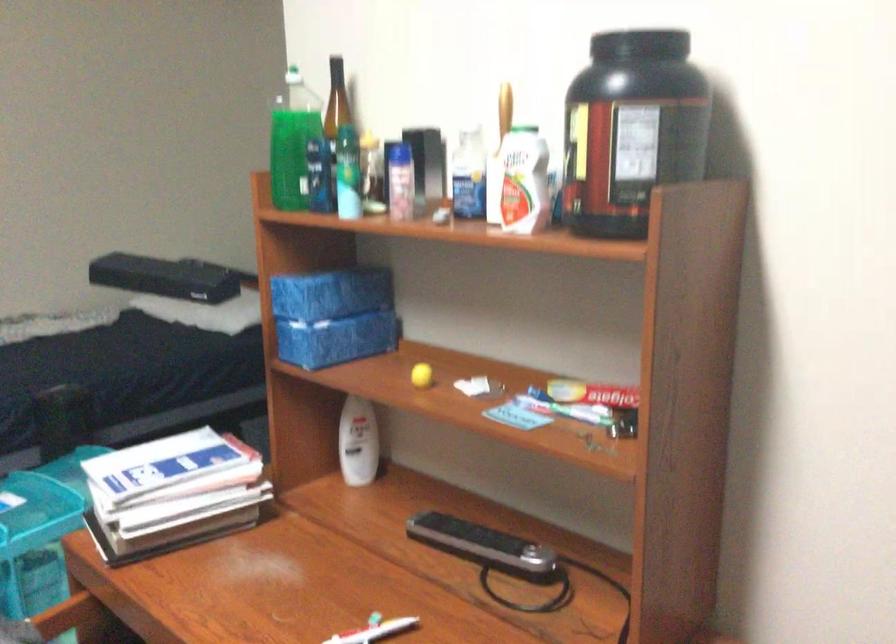
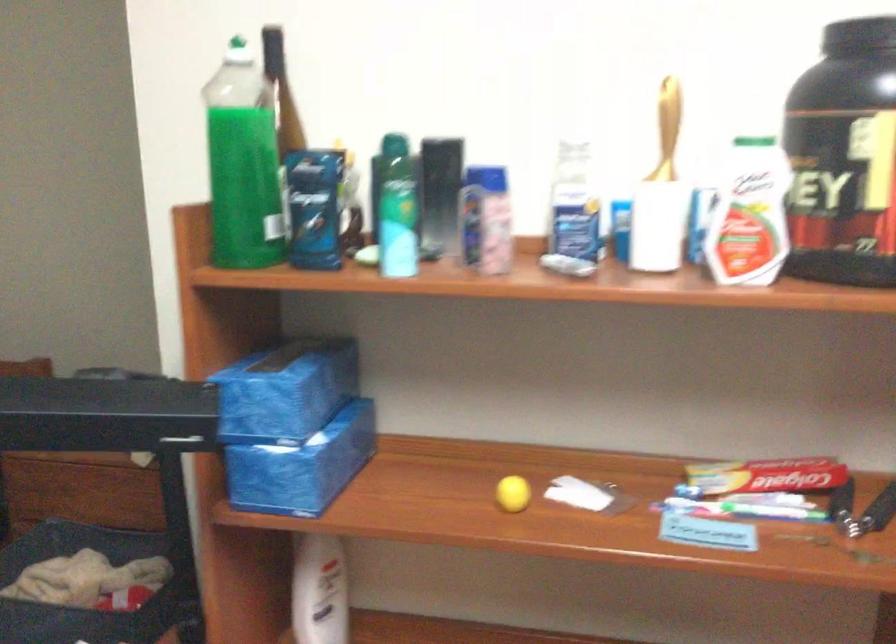
Question: I am providing you with two images of the same scene from different viewpoints. After the viewpoint changes to image2, which objects are now occluded?

Choices:
 (A) large green bottle
 (B) hand grip handle
 (C) white and red bottle
 (D) none of these

Answer: (D)